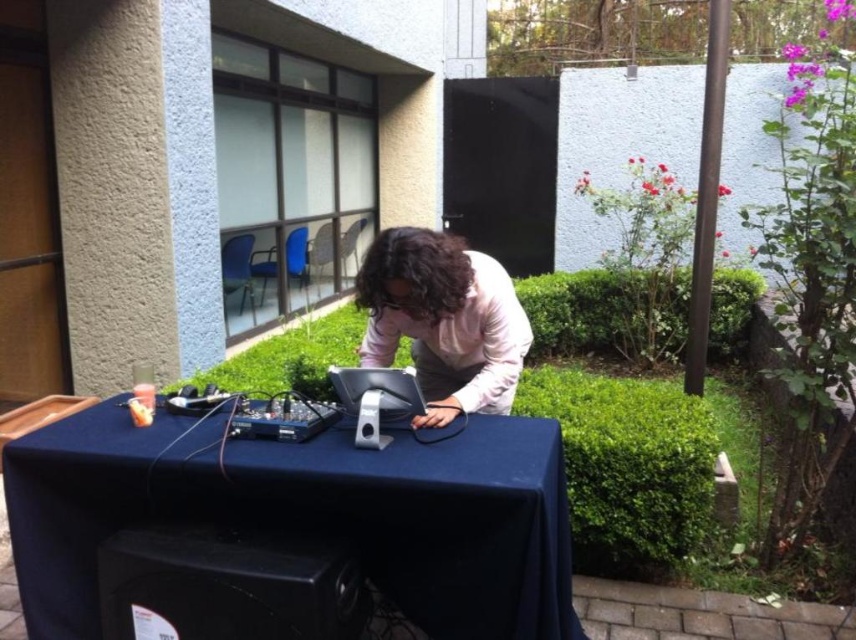
Question: From the image, what is the correct spatial relationship of black plastic speaker at lower center in relation to metallic silver laptop at center?

Choices:
 (A) below
 (B) above

Answer: (A)

Question: Which object is the closest to the metallic silver laptop at center?

Choices:
 (A) pink matte shirt at center
 (B) black plastic speaker at lower center
 (C) blue fabric table at center

Answer: (A)

Question: Which point is closer to the camera taking this photo?

Choices:
 (A) (435, 420)
 (B) (379, 417)
 (C) (117, 541)
 (D) (286, 460)

Answer: (C)

Question: Is blue fabric table at center to the left of pink matte shirt at center from the viewer's perspective?

Choices:
 (A) no
 (B) yes

Answer: (B)

Question: Which is farther from the pink matte shirt at center?

Choices:
 (A) blue fabric table at center
 (B) black plastic speaker at lower center
 (C) metallic silver laptop at center

Answer: (B)

Question: Is pink matte shirt at center thinner than metallic silver laptop at center?

Choices:
 (A) yes
 (B) no

Answer: (B)